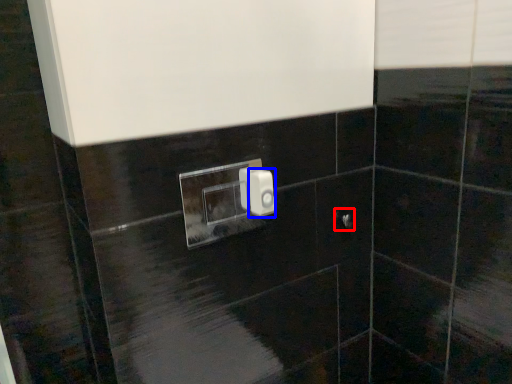
Question: Which object appears closest to the camera in this image, door handle (highlighted by a red box) or light switch (highlighted by a blue box)?

Choices:
 (A) door handle
 (B) light switch

Answer: (B)